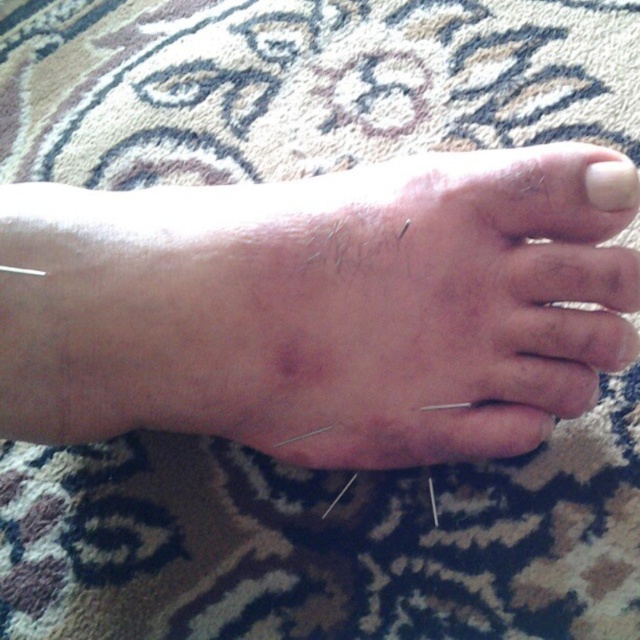
Does skin at center appear over white matte nail at upper right?

Incorrect, skin at center is not positioned above white matte nail at upper right.

Who is positioned more to the right, skin at center or white matte nail at upper right?

Positioned to the right is white matte nail at upper right.

This screenshot has width=640, height=640. Describe the element at coordinates (317, 308) in the screenshot. I see `skin at center` at that location.

You are a GUI agent. You are given a task and a screenshot of the screen. Output one action in this format:
    pyautogui.click(x=<x>, y=<y>)
    Task: Click on the skin at center
    Image resolution: width=640 pixels, height=640 pixels.
    Given the screenshot: What is the action you would take?
    pyautogui.click(x=317, y=308)